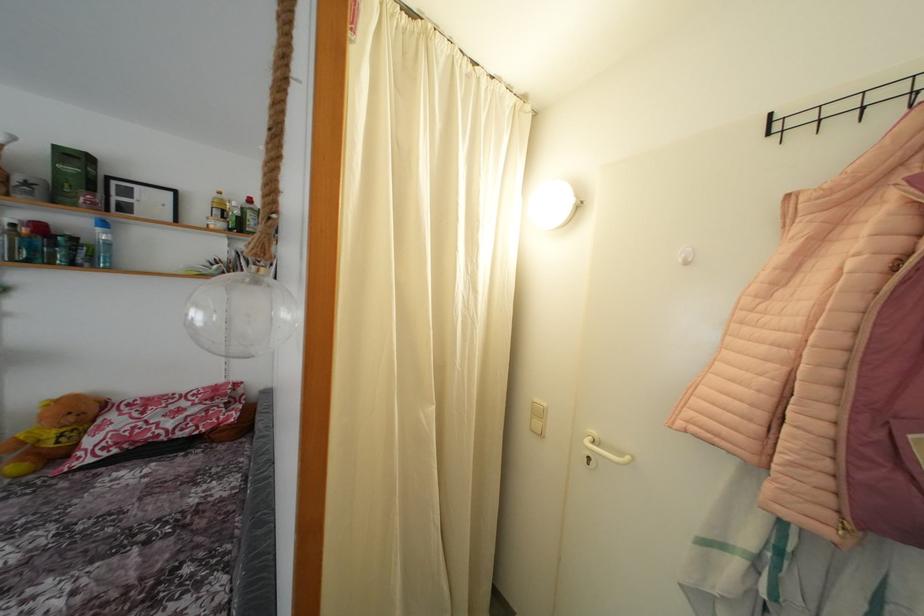
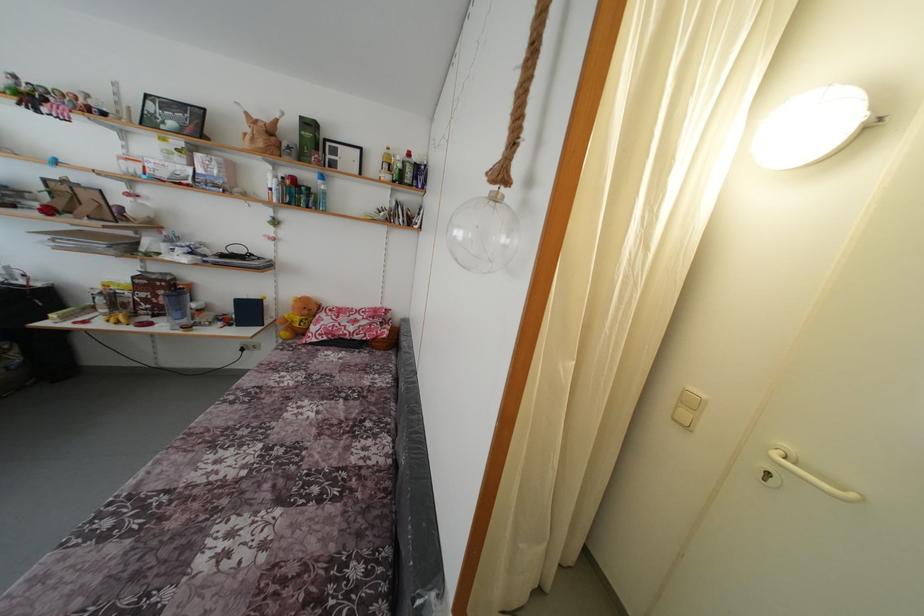
In the second image, find the point that corresponds to point (104, 236) in the first image.

(324, 188)